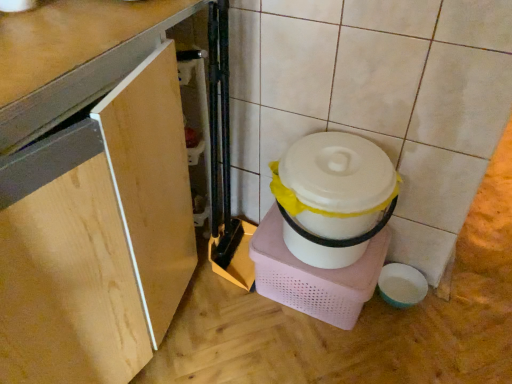
Question: Does wooden cabinet at lower left contain white plastic container at center-right?

Choices:
 (A) no
 (B) yes

Answer: (A)

Question: Can you confirm if wooden cabinet at lower left is wider than white plastic container at center-right?

Choices:
 (A) no
 (B) yes

Answer: (B)

Question: From a real-world perspective, is wooden cabinet at lower left over white plastic container at center-right?

Choices:
 (A) yes
 (B) no

Answer: (A)

Question: Is wooden cabinet at lower left at the left side of white plastic container at center-right?

Choices:
 (A) no
 (B) yes

Answer: (B)

Question: Is wooden cabinet at lower left outside of white plastic container at center-right?

Choices:
 (A) no
 (B) yes

Answer: (B)

Question: Does wooden cabinet at lower left touch white plastic container at center-right?

Choices:
 (A) no
 (B) yes

Answer: (A)

Question: Is wooden cabinet at lower left completely or partially inside white plastic container at center-right?

Choices:
 (A) yes
 (B) no

Answer: (B)

Question: Does white plastic container at center-right have a greater width compared to wooden cabinet at lower left?

Choices:
 (A) yes
 (B) no

Answer: (B)

Question: Does white plastic container at center-right have a smaller size compared to wooden cabinet at lower left?

Choices:
 (A) no
 (B) yes

Answer: (B)

Question: Could you tell me if white plastic container at center-right is facing wooden cabinet at lower left?

Choices:
 (A) yes
 (B) no

Answer: (B)

Question: Is white plastic container at center-right further to camera compared to wooden cabinet at lower left?

Choices:
 (A) no
 (B) yes

Answer: (B)

Question: Does white plastic container at center-right have a greater height compared to wooden cabinet at lower left?

Choices:
 (A) no
 (B) yes

Answer: (A)

Question: Is wooden cabinet at lower left taller or shorter than white plastic container at center-right?

Choices:
 (A) tall
 (B) short

Answer: (A)